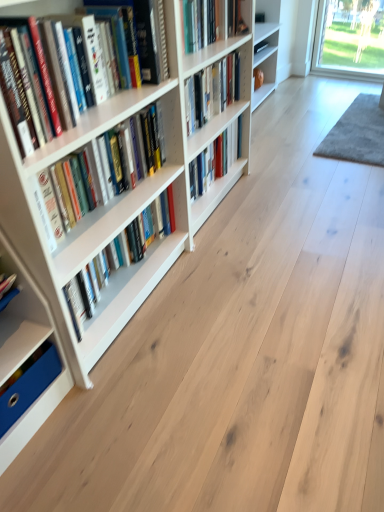
Consider the image. Measure the distance between hardcover books at left, which is the 4th book in top-to-bottom order, and camera.

The depth of hardcover books at left, which is the 4th book in top-to-bottom order, is 3.82 feet.

This screenshot has height=512, width=384. I want to click on hardcover books at left, which is counted as the second book, starting from the bottom, so click(108, 166).

The image size is (384, 512). Describe the element at coordinates (216, 159) in the screenshot. I see `hardcover book at center, which is the 3th book from bottom to top` at that location.

I want to click on white matte bookcase at left, so click(x=121, y=194).

You are a GUI agent. You are given a task and a screenshot of the screen. Output one action in this format:
    pyautogui.click(x=<x>, y=<y>)
    Task: Click on the hardcover books at left, the second book from the top
    Image resolution: width=384 pixels, height=512 pixels.
    Given the screenshot: What is the action you would take?
    pyautogui.click(x=99, y=75)

Locate an element on the screen. The image size is (384, 512). hardcover books at left, which is counted as the second book, starting from the bottom is located at coordinates (108, 166).

Which of these two, white matte bookcase at left or hardcover book at center, acting as the fifth book starting from the bottom, stands shorter?

hardcover book at center, acting as the fifth book starting from the bottom, is shorter.

At what (x,y) coordinates should I click in order to perform the action: click on book that is the 1st object to the right of the white matte bookcase at left, starting at the anchor. Please return your answer as a coordinate pair (x, y). Image resolution: width=384 pixels, height=512 pixels. Looking at the image, I should click on (211, 91).

Is white matte bookcase at left at the left side of hardcover book at center, acting as the 1th book starting from the top?

Yes.

Would you say white matte bookcase at left contains hardcover book at center, acting as the fifth book starting from the bottom?

Yes, hardcover book at center, acting as the fifth book starting from the bottom, is a part of white matte bookcase at left.

How many degrees apart are the facing directions of blue cardboard box at lower left, the 1th book when ordered from bottom to top, and white matte bookshelf at left?

There is a 1.05-degree angle between the facing directions of blue cardboard box at lower left, the 1th book when ordered from bottom to top, and white matte bookshelf at left.

Considering the sizes of objects blue cardboard box at lower left, the fifth book when ordered from top to bottom, and white matte bookshelf at left in the image provided, who is wider, blue cardboard box at lower left, the fifth book when ordered from top to bottom, or white matte bookshelf at left?

white matte bookshelf at left is wider.

Which object is closer to the camera, blue cardboard box at lower left, the fifth book when ordered from top to bottom, or white matte bookshelf at left?

Positioned in front is white matte bookshelf at left.

From a real-world perspective, does blue cardboard box at lower left, the 1th book when ordered from bottom to top, stand above white matte bookshelf at left?

No, from a real-world perspective, blue cardboard box at lower left, the 1th book when ordered from bottom to top, is not on top of white matte bookshelf at left.

From the image's perspective, which is below, hardcover book at center, acting as the 1th book starting from the top, or white matte bookcase at left?

white matte bookcase at left, from the image's perspective.

Considering the sizes of objects hardcover book at center, acting as the fifth book starting from the bottom, and white matte bookcase at left in the image provided, who is thinner, hardcover book at center, acting as the fifth book starting from the bottom, or white matte bookcase at left?

hardcover book at center, acting as the fifth book starting from the bottom, is thinner.

How many degrees apart are the facing directions of hardcover book at center, acting as the fifth book starting from the bottom, and white matte bookcase at left?

There is a 0.204-degree angle between the facing directions of hardcover book at center, acting as the fifth book starting from the bottom, and white matte bookcase at left.

From a real-world perspective, starting from the blue cardboard box at lower left, the 1th book when ordered from bottom to top, which book is the 4th one vertically above it? Please provide its 2D coordinates.

[(99, 75)]

Measure the distance between hardcover books at left, the second book from the top, and blue cardboard box at lower left, the 1th book when ordered from bottom to top.

hardcover books at left, the second book from the top, and blue cardboard box at lower left, the 1th book when ordered from bottom to top, are 73.99 centimeters apart.

Is hardcover books at left, the second book from the top, far from blue cardboard box at lower left, the fifth book when ordered from top to bottom?

hardcover books at left, the second book from the top, is near blue cardboard box at lower left, the fifth book when ordered from top to bottom, not far away.

Considering the positions of objects hardcover books at left, the second book from the top, and blue cardboard box at lower left, the 1th book when ordered from bottom to top, in the image provided, who is more to the right, hardcover books at left, the second book from the top, or blue cardboard box at lower left, the 1th book when ordered from bottom to top,?

hardcover books at left, the second book from the top.

Measure the distance from hardcover book at center, which is the 3th book from bottom to top, to white matte bookcase at left.

The distance of hardcover book at center, which is the 3th book from bottom to top, from white matte bookcase at left is 14.71 inches.

Between hardcover book at center, which is the 3th book from bottom to top, and white matte bookcase at left, which one has smaller width?

With smaller width is hardcover book at center, which is the 3th book from bottom to top.

Does point (209, 147) lie behind point (21, 230)?

Yes, point (209, 147) is farther from viewer.

Between hardcover book at center, which ranks as the third book in top-to-bottom order, and white matte bookcase at left, which one has smaller size?

hardcover book at center, which ranks as the third book in top-to-bottom order, is smaller.

I want to click on the 1st book counting from the left side of the hardcover book at center, which is the 3th book from bottom to top, so click(x=211, y=91).

From the image's perspective, between hardcover book at center, which is the 3th book from bottom to top, and hardcover book at center, acting as the 1th book starting from the top, which one is located above?

hardcover book at center, acting as the 1th book starting from the top.

Could you tell me if hardcover book at center, which is the 3th book from bottom to top, is turned towards hardcover book at center, acting as the 1th book starting from the top?

No.

Which object is thinner, blue cardboard box at lower left, the fifth book when ordered from top to bottom, or hardcover book at center, which ranks as the third book in top-to-bottom order?

hardcover book at center, which ranks as the third book in top-to-bottom order, is thinner.

Is hardcover book at center, which is the 3th book from bottom to top, completely or partially inside blue cardboard box at lower left, the 1th book when ordered from bottom to top?

No, hardcover book at center, which is the 3th book from bottom to top, is located outside of blue cardboard box at lower left, the 1th book when ordered from bottom to top.

From a real-world perspective, is blue cardboard box at lower left, the 1th book when ordered from bottom to top, positioned above or below hardcover book at center, which is the 3th book from bottom to top?

blue cardboard box at lower left, the 1th book when ordered from bottom to top, is situated lower than hardcover book at center, which is the 3th book from bottom to top, in the real world.

Who is smaller, blue cardboard box at lower left, the fifth book when ordered from top to bottom, or hardcover book at center, which ranks as the third book in top-to-bottom order?

blue cardboard box at lower left, the fifth book when ordered from top to bottom.

At what (x,y) coordinates should I click in order to perform the action: click on book that is the 2nd object located above the white matte bookcase at left (from the image's perspective). Please return your answer as a coordinate pair (x, y). Looking at the image, I should click on (211, 91).

The image size is (384, 512). What are the coordinates of `the 2nd book behind the white matte bookshelf at left, starting your count from the anchor` in the screenshot? It's located at (28, 388).

Considering their positions, is hardcover book at center, acting as the 1th book starting from the top, positioned further to white matte bookcase at left than white matte bookshelf at left?

white matte bookshelf at left is positioned further to the anchor white matte bookcase at left.

Looking at this image, considering their positions, is blue cardboard box at lower left, the fifth book when ordered from top to bottom, positioned further to hardcover book at center, acting as the fifth book starting from the bottom, than hardcover book at center, which ranks as the third book in top-to-bottom order?

The object further to hardcover book at center, acting as the fifth book starting from the bottom, is blue cardboard box at lower left, the fifth book when ordered from top to bottom.

Considering their positions, is white matte bookcase at left positioned further to hardcover books at left, which is the 4th book in top-to-bottom order, than white matte bookshelf at left?

white matte bookshelf at left is positioned further to the anchor hardcover books at left, which is the 4th book in top-to-bottom order.

Estimate the real-world distances between objects in this image. Which object is further from hardcover book at center, which ranks as the third book in top-to-bottom order, white matte bookshelf at left or hardcover books at left, which is the 4th book in top-to-bottom order?

Among the two, white matte bookshelf at left is located further to hardcover book at center, which ranks as the third book in top-to-bottom order.

Considering their positions, is white matte bookshelf at left positioned further to hardcover books at left, which is counted as the second book, starting from the bottom, than blue cardboard box at lower left, the fifth book when ordered from top to bottom?

The object further to hardcover books at left, which is counted as the second book, starting from the bottom, is blue cardboard box at lower left, the fifth book when ordered from top to bottom.

When comparing their distances from hardcover books at left, the second book from the top, does white matte bookshelf at left or hardcover book at center, which is the 3th book from bottom to top, seem closer?

Based on the image, white matte bookshelf at left appears to be nearer to hardcover books at left, the second book from the top.

Looking at the image, which one is located further to hardcover books at left, which ranks as the fourth book in bottom-to-top order, hardcover book at center, which ranks as the third book in top-to-bottom order, or white matte bookcase at left?

hardcover book at center, which ranks as the third book in top-to-bottom order, is positioned further to the anchor hardcover books at left, which ranks as the fourth book in bottom-to-top order.

Which object lies nearer to the anchor point blue cardboard box at lower left, the fifth book when ordered from top to bottom, white matte bookshelf at left or hardcover book at center, acting as the fifth book starting from the bottom?

white matte bookshelf at left is positioned closer to the anchor blue cardboard box at lower left, the fifth book when ordered from top to bottom.

Find the location of a particular element. Image resolution: width=384 pixels, height=512 pixels. shelf between white matte bookcase at left and blue cardboard box at lower left, the fifth book when ordered from top to bottom, in the up-down direction is located at coordinates (27, 353).

You are a GUI agent. You are given a task and a screenshot of the screen. Output one action in this format:
    pyautogui.click(x=<x>, y=<y>)
    Task: Click on the bookcase positioned between white matte bookshelf at left and hardcover book at center, which ranks as the third book in top-to-bottom order, from near to far
    The image size is (384, 512).
    Given the screenshot: What is the action you would take?
    pyautogui.click(x=121, y=194)

Where is `shelf between hardcover books at left, which is the 4th book in top-to-bottom order, and blue cardboard box at lower left, the fifth book when ordered from top to bottom, in the up-down direction`? shelf between hardcover books at left, which is the 4th book in top-to-bottom order, and blue cardboard box at lower left, the fifth book when ordered from top to bottom, in the up-down direction is located at coordinates (27, 353).

At what (x,y) coordinates should I click in order to perform the action: click on bookcase between hardcover books at left, the second book from the top, and blue cardboard box at lower left, the 1th book when ordered from bottom to top, vertically. Please return your answer as a coordinate pair (x, y). This screenshot has height=512, width=384. Looking at the image, I should click on (121, 194).